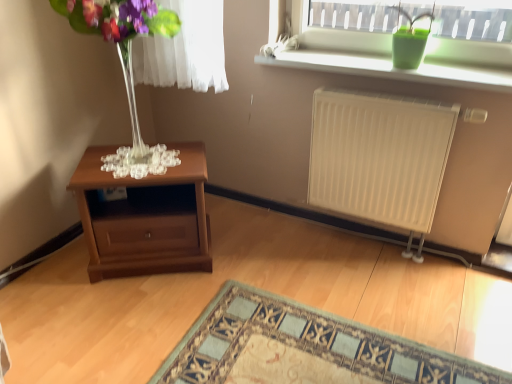
In order to click on blank area beneath green matte pot at upper right (from a real-world perspective) in this screenshot , I will do `click(405, 68)`.